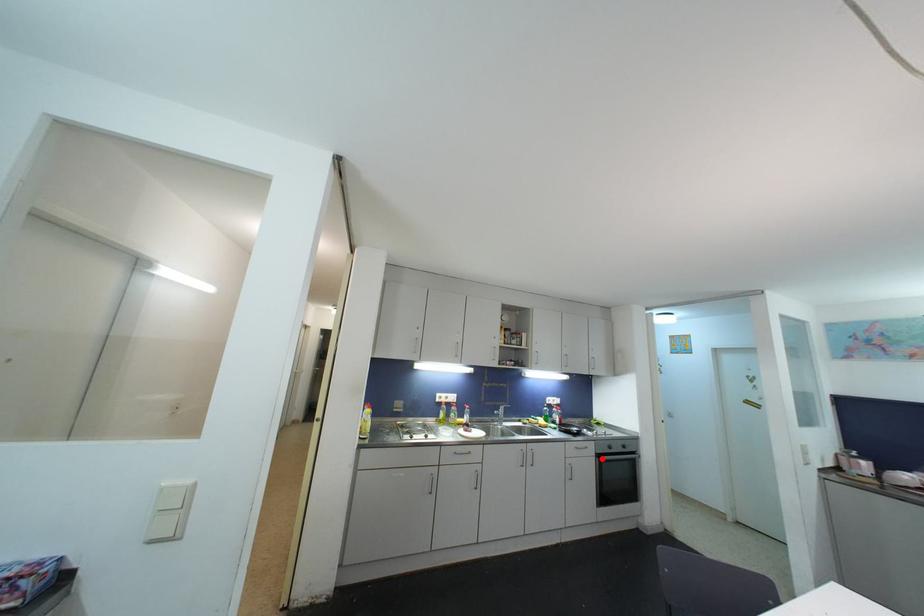
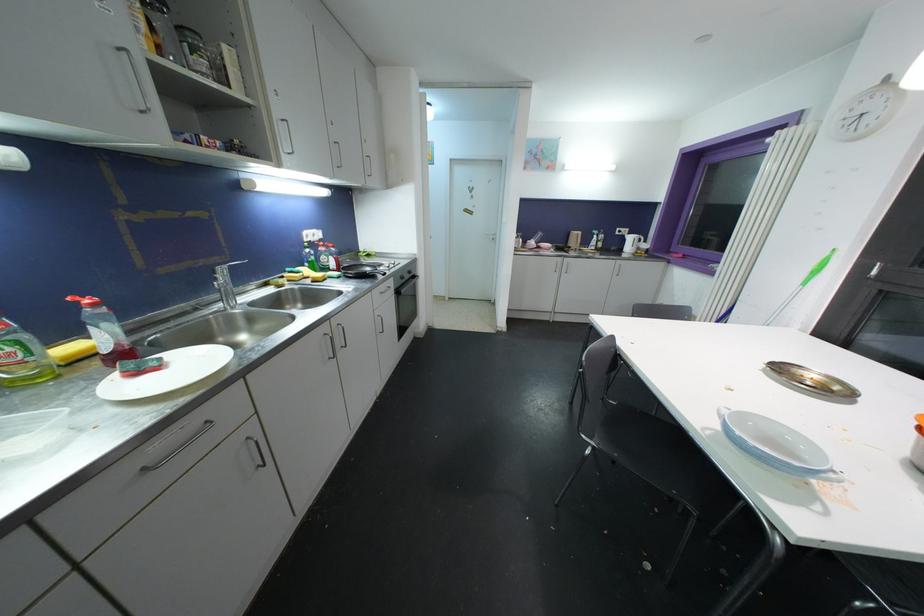
Question: I am providing you with two images of the same scene from different viewpoints. A red point is marked on the first image. At the location where the point appears in image 1, is it still visible in image 2?

Choices:
 (A) Yes
 (B) No

Answer: (A)